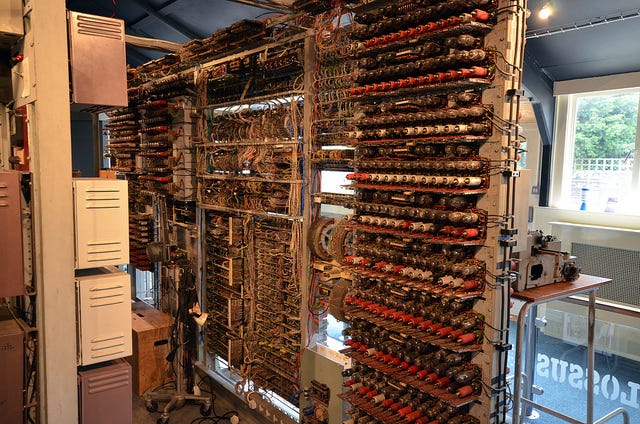
Where is `wires`? The width and height of the screenshot is (640, 424). wires is located at coordinates (65, 259), (173, 154), (301, 166).